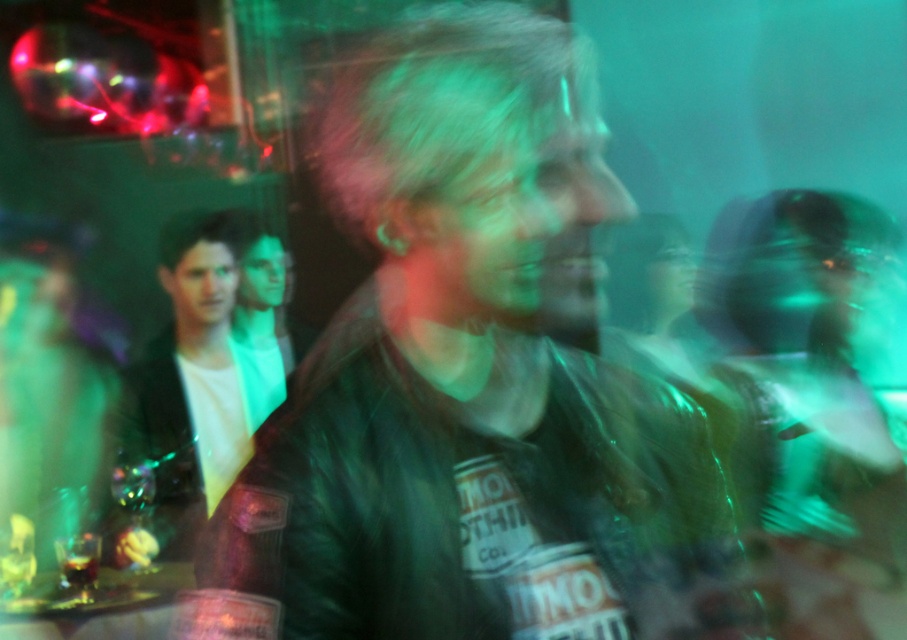
You are at point [180,237] and want to move to point [413,104]. Is the path clear?

Yes, the path is clear because point [413,104] is in front of point [180,237], meaning there are no obstructions between them.

You are trying to decide which jacket to buy based on the image. The leather jacket at center and the white leather jacket at left are both in the scene. Which one is shorter?

The leather jacket at center is shorter than the white leather jacket at left.

In the scene shown: You are a photographer trying to capture a clear shot of both the leather jacket at center and the white leather jacket at left. Given that your camera has a minimum focus distance of 5 feet, will you be able to focus on both jackets simultaneously?

The leather jacket at center and white leather jacket at left are 4.67 feet apart, which is less than the camera minimum focus distance of 5 feet. Therefore, you cannot focus on both jackets simultaneously.